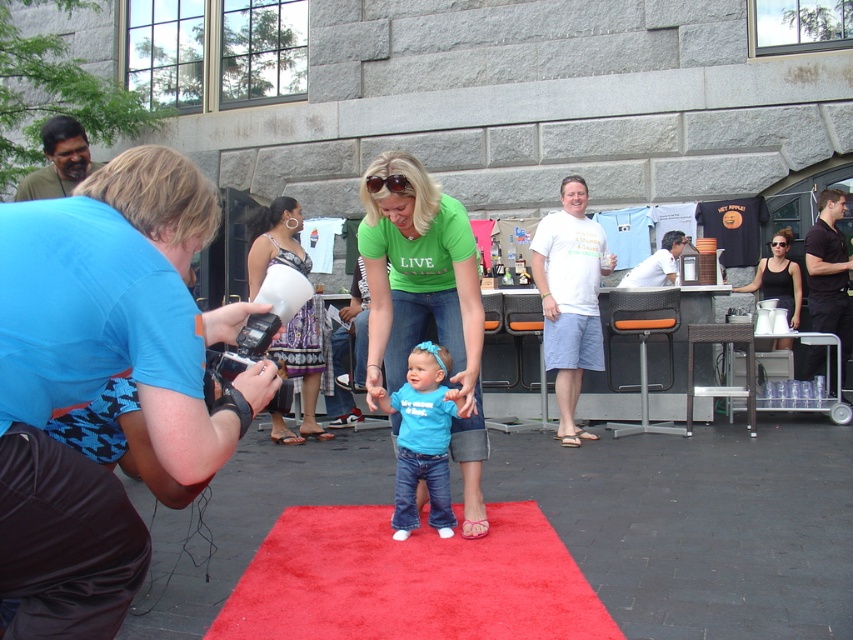
Question: Can you confirm if blue fabric camera at left is positioned to the right of patterned fabric dress at center?

Choices:
 (A) yes
 (B) no

Answer: (A)

Question: Which point is farther to the camera?

Choices:
 (A) white cotton t-shirt at center
 (B) matte blue t-shirt at center
 (C) shiny red carpet at center

Answer: (A)

Question: Considering the real-world distances, which object is closest to the patterned fabric dress at center?

Choices:
 (A) black smooth t-shirt at right
 (B) blue fabric camera at left

Answer: (B)

Question: Does white cotton t-shirt at center come behind black fabric tank top at upper right?

Choices:
 (A) yes
 (B) no

Answer: (B)

Question: Can you confirm if white cotton t-shirt at center is wider than white shirt at center?

Choices:
 (A) no
 (B) yes

Answer: (A)

Question: Which of the following is the farthest from the observer?

Choices:
 (A) (554, 621)
 (B) (419, 182)
 (C) (280, 212)

Answer: (C)